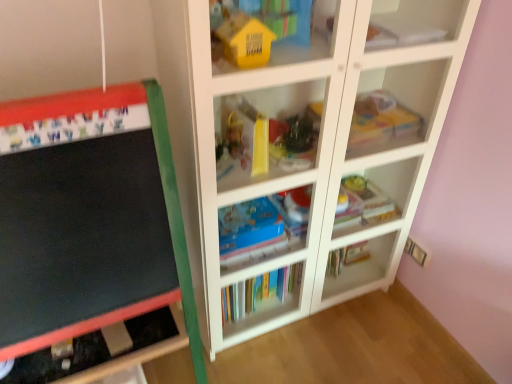
Question: Can you confirm if white paper at upper right, which is the 3th book in bottom-to-top order, is shorter than white glossy bookshelf at center, which is counted as the 1th shelf, starting from the top?

Choices:
 (A) yes
 (B) no

Answer: (A)

Question: Is white paper at upper right, which is the 3th book in bottom-to-top order, positioned in front of white glossy bookshelf at center, which is counted as the 1th shelf, starting from the top?

Choices:
 (A) no
 (B) yes

Answer: (A)

Question: Is white paper at upper right, which ranks as the 1th book in top-to-bottom order, taller than white glossy bookshelf at center, which is counted as the 1th shelf, starting from the top?

Choices:
 (A) no
 (B) yes

Answer: (A)

Question: Can you confirm if white paper at upper right, which ranks as the 1th book in top-to-bottom order, is smaller than white glossy bookshelf at center, the 2th shelf ordered from the bottom?

Choices:
 (A) yes
 (B) no

Answer: (A)

Question: Considering the relative sizes of white paper at upper right, which ranks as the 1th book in top-to-bottom order, and white glossy bookshelf at center, the 2th shelf ordered from the bottom, in the image provided, is white paper at upper right, which ranks as the 1th book in top-to-bottom order, wider than white glossy bookshelf at center, the 2th shelf ordered from the bottom,?

Choices:
 (A) yes
 (B) no

Answer: (B)

Question: Considering the positions of translucent plastic toy at upper right, acting as the 1th toy starting from the right, and white paper at upper right, which ranks as the 1th book in top-to-bottom order, in the image, is translucent plastic toy at upper right, acting as the 1th toy starting from the right, wider or thinner than white paper at upper right, which ranks as the 1th book in top-to-bottom order,?

Choices:
 (A) thin
 (B) wide

Answer: (B)

Question: Considering the positions of translucent plastic toy at upper right, the third toy viewed from the front, and white paper at upper right, which is the 3th book in bottom-to-top order, in the image, is translucent plastic toy at upper right, the third toy viewed from the front, taller or shorter than white paper at upper right, which is the 3th book in bottom-to-top order,?

Choices:
 (A) tall
 (B) short

Answer: (A)

Question: Is point (353, 120) positioned closer to the camera than point (382, 28)?

Choices:
 (A) farther
 (B) closer

Answer: (A)

Question: Based on their positions, is translucent plastic toy at upper right, the third toy viewed from the front, located to the left or right of white paper at upper right, which ranks as the 1th book in top-to-bottom order?

Choices:
 (A) left
 (B) right

Answer: (A)

Question: Is multicolored paperbacks at center, the third book viewed from the top, spatially inside white glossy bookshelf at center, the 2th shelf ordered from the bottom, or outside of it?

Choices:
 (A) inside
 (B) outside

Answer: (A)

Question: Based on their positions, is multicolored paperbacks at center, arranged as the 1th book when ordered from the bottom, located to the left or right of white glossy bookshelf at center, the 2th shelf ordered from the bottom?

Choices:
 (A) right
 (B) left

Answer: (B)

Question: In terms of size, does multicolored paperbacks at center, arranged as the 1th book when ordered from the bottom, appear bigger or smaller than white glossy bookshelf at center, the 2th shelf ordered from the bottom?

Choices:
 (A) big
 (B) small

Answer: (B)

Question: From their relative heights in the image, would you say multicolored paperbacks at center, arranged as the 1th book when ordered from the bottom, is taller or shorter than white glossy bookshelf at center, which is counted as the 1th shelf, starting from the top?

Choices:
 (A) short
 (B) tall

Answer: (A)

Question: Is point (294, 158) positioned closer to the camera than point (411, 200)?

Choices:
 (A) closer
 (B) farther

Answer: (A)

Question: From the image's perspective, is shiny plastic toy at center, the 2th toy from the front, located above or below white glossy bookshelf at center, which is counted as the 1th shelf, starting from the top?

Choices:
 (A) above
 (B) below

Answer: (A)